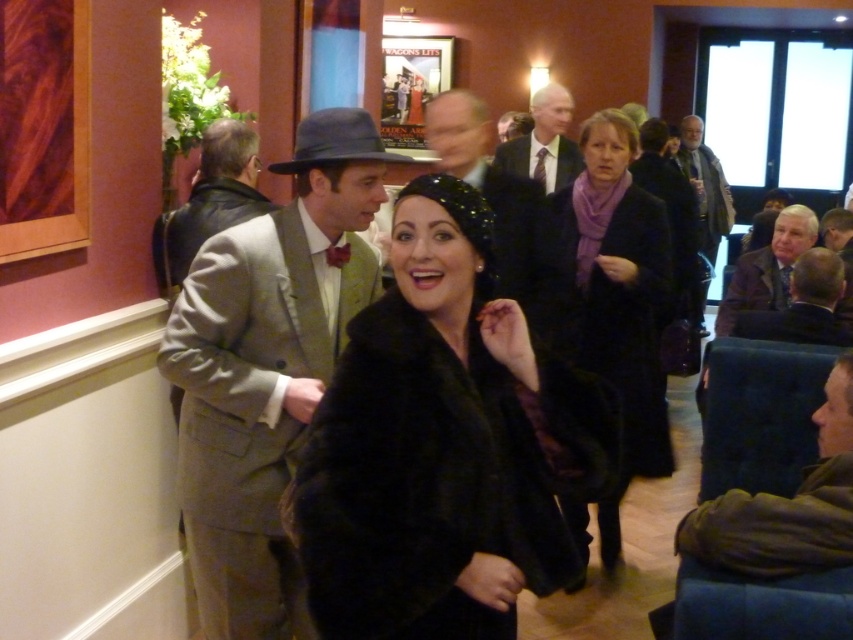
Question: Is dark green jacket at lower right positioned in front of brown leather jacket at lower right?

Choices:
 (A) yes
 (B) no

Answer: (A)

Question: Which point is farther to the camera?

Choices:
 (A) matte black coat at center
 (B) matte black fedora at center

Answer: (A)

Question: Which point appears farthest from the camera in this image?

Choices:
 (A) (199, 403)
 (B) (795, 604)

Answer: (A)

Question: Is light brown leather jacket at center smaller than dark brown leather jacket at lower right?

Choices:
 (A) yes
 (B) no

Answer: (A)

Question: Which object is farther from the camera taking this photo?

Choices:
 (A) dark green jacket at lower right
 (B) black fur coat at center
 (C) matte black coat at center

Answer: (C)

Question: Is smooth black suit at center further to the viewer compared to matte black suit at center?

Choices:
 (A) no
 (B) yes

Answer: (A)